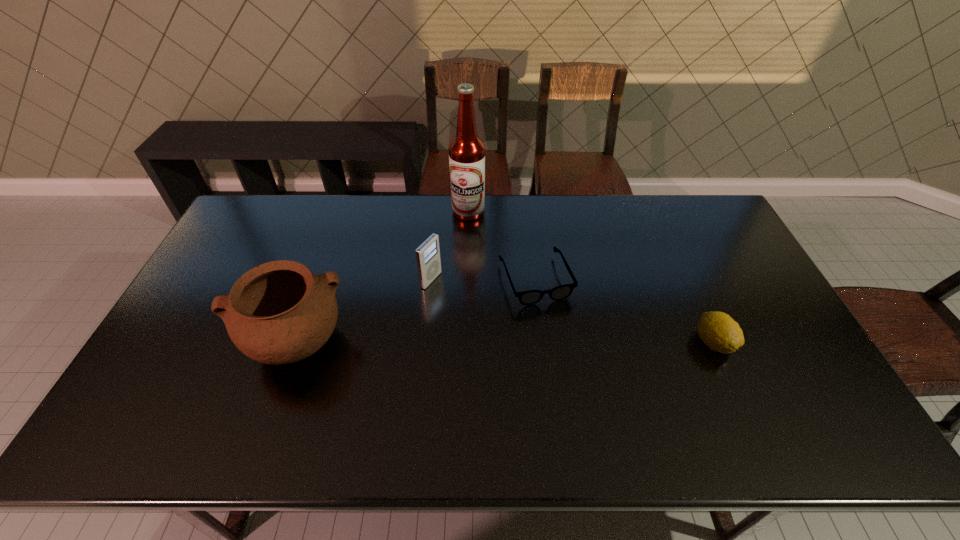
Identify the location of the fourth shortest object. (277, 313).

Where is `the leftmost object`? The height and width of the screenshot is (540, 960). the leftmost object is located at coordinates (277, 313).

Identify the location of the second shortest object. (718, 330).

Locate an element on the screen. The height and width of the screenshot is (540, 960). lemon is located at coordinates (718, 330).

The height and width of the screenshot is (540, 960). I want to click on the shortest object, so click(531, 297).

Identify the location of spectacles. (531, 297).

Where is `the third shortest object`? The height and width of the screenshot is (540, 960). the third shortest object is located at coordinates (428, 259).

This screenshot has width=960, height=540. In order to click on the second object from left to right in this screenshot , I will do `click(428, 259)`.

Identify the location of the third object from left to right. Image resolution: width=960 pixels, height=540 pixels. (467, 153).

Image resolution: width=960 pixels, height=540 pixels. Find the location of `alcohol`. alcohol is located at coordinates coord(467,153).